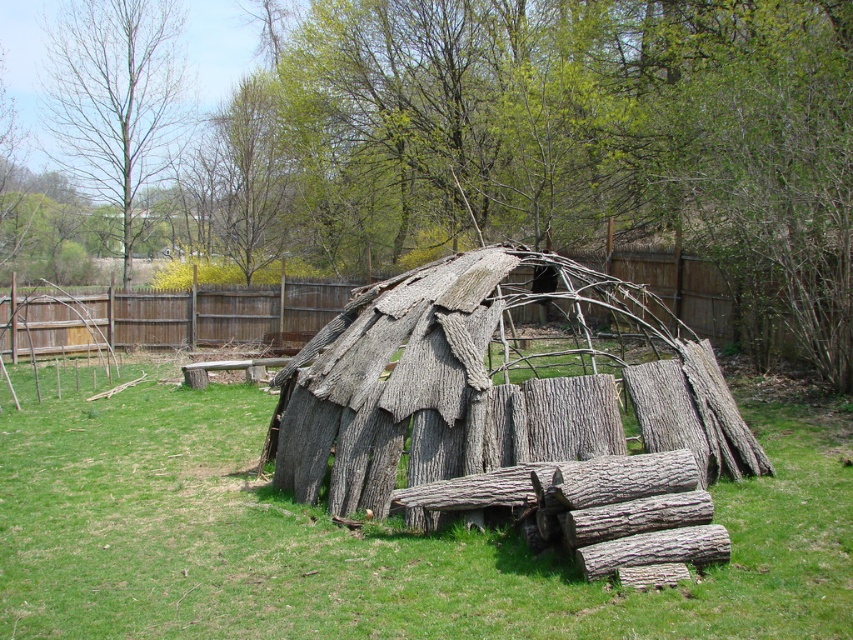
The image size is (853, 640). What are the coordinates of `natural bark tree at center` in the screenshot? It's located at (461, 147).

Is natural bark tree at center smaller than green grass at center?

No, natural bark tree at center is not smaller than green grass at center.

Does point (527, 36) lie in front of point (138, 452)?

No, (527, 36) is further to viewer.

You are a GUI agent. You are given a task and a screenshot of the screen. Output one action in this format:
    pyautogui.click(x=<x>, y=<y>)
    Task: Click on the natural bark tree at center
    
    Given the screenshot: What is the action you would take?
    (x=461, y=147)

Who is taller, gray bark hut at center or bare wood tree at upper left?

gray bark hut at center

From the picture: Can you confirm if gray bark hut at center is thinner than bare wood tree at upper left?

In fact, gray bark hut at center might be wider than bare wood tree at upper left.

Where is `gray bark hut at center`? gray bark hut at center is located at coordinates (509, 420).

Who is higher up, green grass at center or gray bark hut at center?

gray bark hut at center is higher up.

Who is shorter, green grass at center or gray bark hut at center?

With less height is gray bark hut at center.

Describe the element at coordinates (363, 536) in the screenshot. The height and width of the screenshot is (640, 853). I see `green grass at center` at that location.

Where is `green grass at center`? The image size is (853, 640). green grass at center is located at coordinates [x=363, y=536].